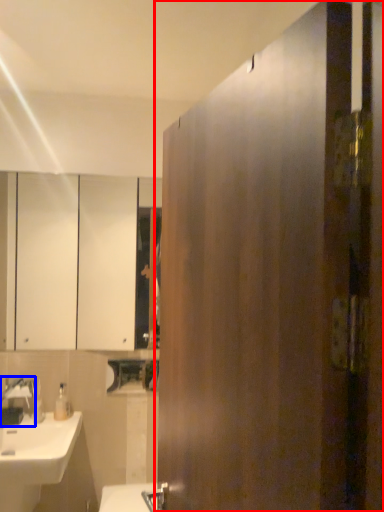
Question: Among these objects, which one is farthest to the camera, door (highlighted by a red box) or tap (highlighted by a blue box)?

Choices:
 (A) door
 (B) tap

Answer: (B)